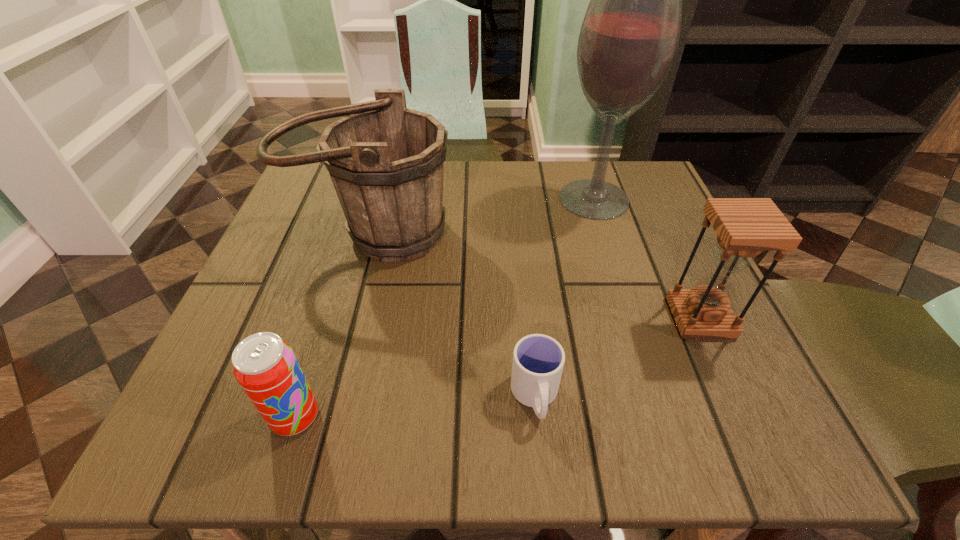
This screenshot has height=540, width=960. Identify the location of the tallest object. (629, 37).

You are a GUI agent. You are given a task and a screenshot of the screen. Output one action in this format:
    pyautogui.click(x=<x>, y=<y>)
    Task: Click on the second tallest object
    The height and width of the screenshot is (540, 960).
    Given the screenshot: What is the action you would take?
    pyautogui.click(x=386, y=162)

Where is `the third shortest object`? The height and width of the screenshot is (540, 960). the third shortest object is located at coordinates (745, 227).

I want to click on hourglass, so click(745, 227).

At what (x,y) coordinates should I click in order to perform the action: click on the fourth tallest object. Please return your answer as a coordinate pair (x, y). The width and height of the screenshot is (960, 540). Looking at the image, I should click on (x=265, y=366).

The width and height of the screenshot is (960, 540). Identify the location of cup. (538, 360).

Identify the location of the third object from right to left. [538, 360].

Where is `vacant space situated 0.080m on the front of the alcohol`? Image resolution: width=960 pixels, height=540 pixels. vacant space situated 0.080m on the front of the alcohol is located at coordinates (609, 247).

Locate an element on the screen. free space located 0.130m on the handle side of the bucket is located at coordinates (347, 326).

This screenshot has height=540, width=960. Find the location of `vacant area located 0.060m on the left of the third shortest object`. vacant area located 0.060m on the left of the third shortest object is located at coordinates (637, 318).